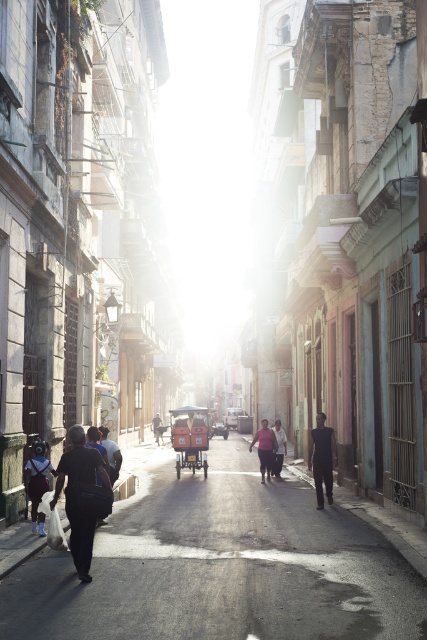
Is pink matte shirt at center wider than dark gray fabric bag at center?

No.

Which is behind, point (262, 420) or point (160, 422)?

Positioned behind is point (160, 422).

Is point (262, 420) in front of point (160, 436)?

Yes, it is.

The image size is (427, 640). I want to click on pink matte shirt at center, so click(265, 449).

Measure the distance between point (x=113, y=464) and camera.

The distance of point (x=113, y=464) from camera is 12.65 meters.

Is point (114, 461) less distant than point (222, 433)?

Yes, point (114, 461) is closer to viewer.

This screenshot has height=640, width=427. Describe the element at coordinates (111, 452) in the screenshot. I see `dark blue fabric bag at lower left` at that location.

Locate an element on the screen. The height and width of the screenshot is (640, 427). dark blue fabric bag at lower left is located at coordinates (111, 452).

Where is `pink matte shirt at center`? pink matte shirt at center is located at coordinates (265, 449).

Between point (251, 444) and point (224, 438), which one is positioned behind?

The point (224, 438) is behind.

Find the location of a particular element. The height and width of the screenshot is (640, 427). pink matte shirt at center is located at coordinates point(265,449).